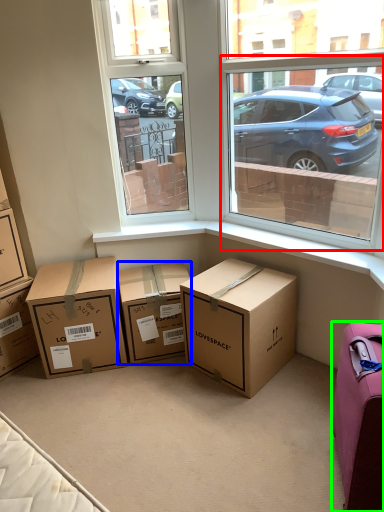
Question: Considering the real-world distances, which object is farthest from window screen (highlighted by a red box)? box (highlighted by a blue box) or suitcase (highlighted by a green box)?

Choices:
 (A) box
 (B) suitcase

Answer: (B)